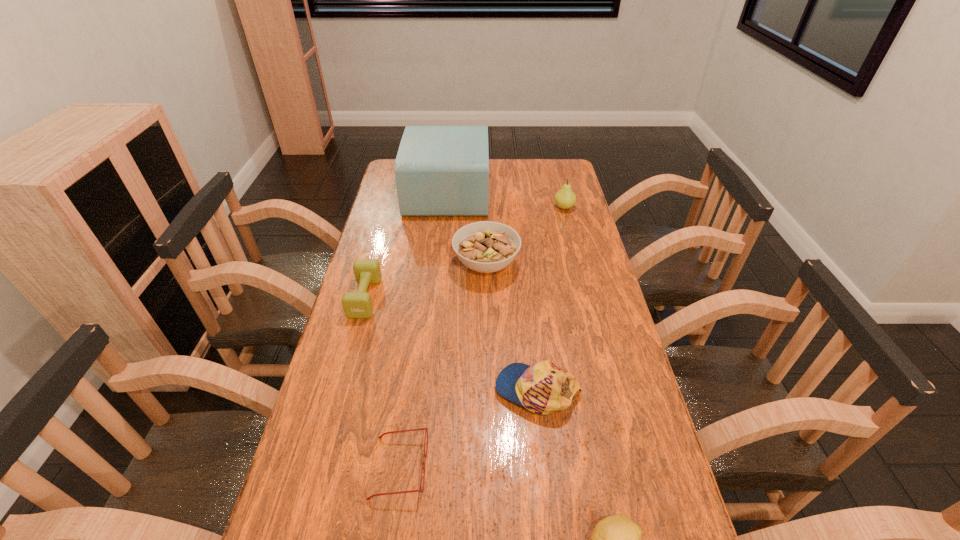
You are a GUI agent. You are given a task and a screenshot of the screen. Output one action in this format:
    pyautogui.click(x=<x>, y=<y>)
    Task: Click on the radio receiver
    The height and width of the screenshot is (540, 960).
    Given the screenshot: What is the action you would take?
    pyautogui.click(x=440, y=170)

At what (x,y) coordinates should I click in order to perform the action: click on pear. Please return your answer as a coordinate pair (x, y). The height and width of the screenshot is (540, 960). Looking at the image, I should click on (565, 198).

Find the location of a particular element. stew is located at coordinates (486, 247).

Locate an element on the screen. The image size is (960, 540). cap is located at coordinates (543, 388).

Image resolution: width=960 pixels, height=540 pixels. I want to click on the leftmost object, so click(x=358, y=304).

Find the location of a particular element. The width and height of the screenshot is (960, 540). spectacles is located at coordinates (426, 428).

Locate an element on the screen. the second nearest object is located at coordinates (426, 428).

The height and width of the screenshot is (540, 960). I want to click on free space located on the front panel of the tallest object, so click(547, 193).

Where is `vacant space located 0.280m on the back of the pear`? vacant space located 0.280m on the back of the pear is located at coordinates (554, 168).

Find the location of a particular element. free space located on the left of the stew is located at coordinates (385, 264).